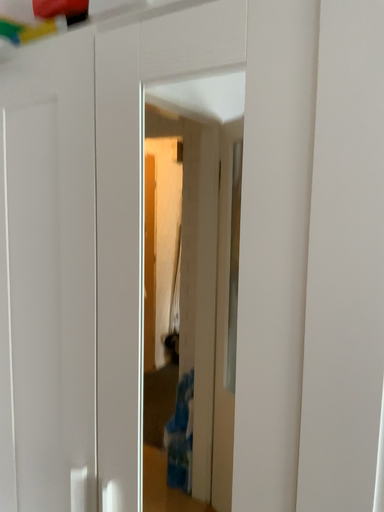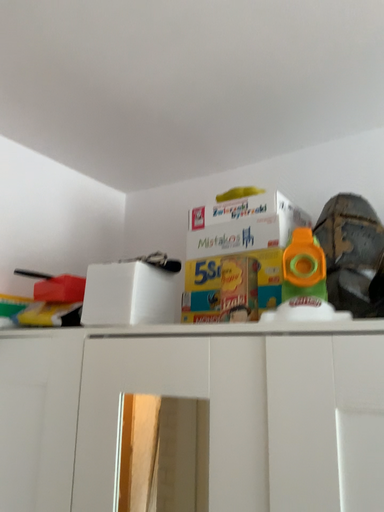
Question: How did the camera likely rotate when shooting the video?

Choices:
 (A) rotated downward
 (B) rotated upward

Answer: (B)